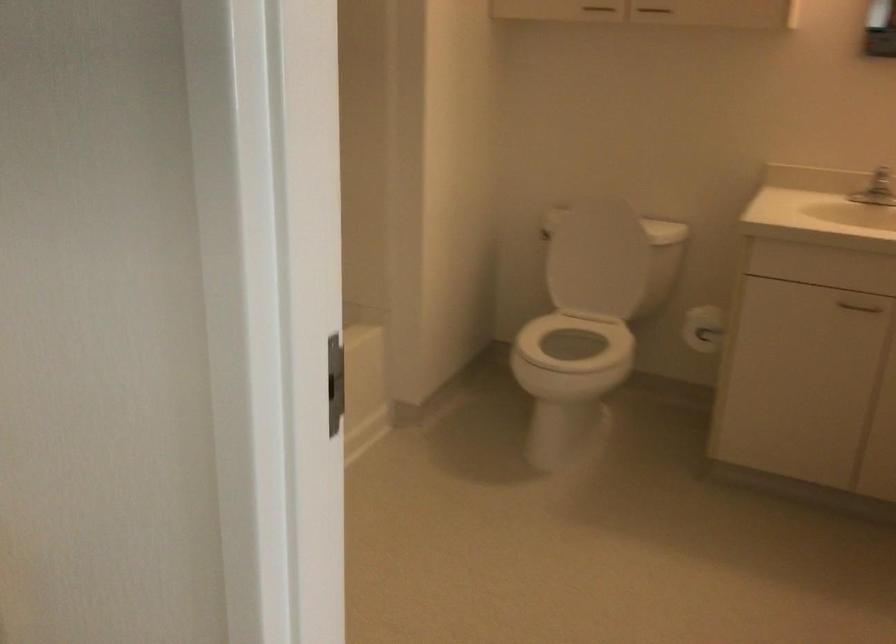
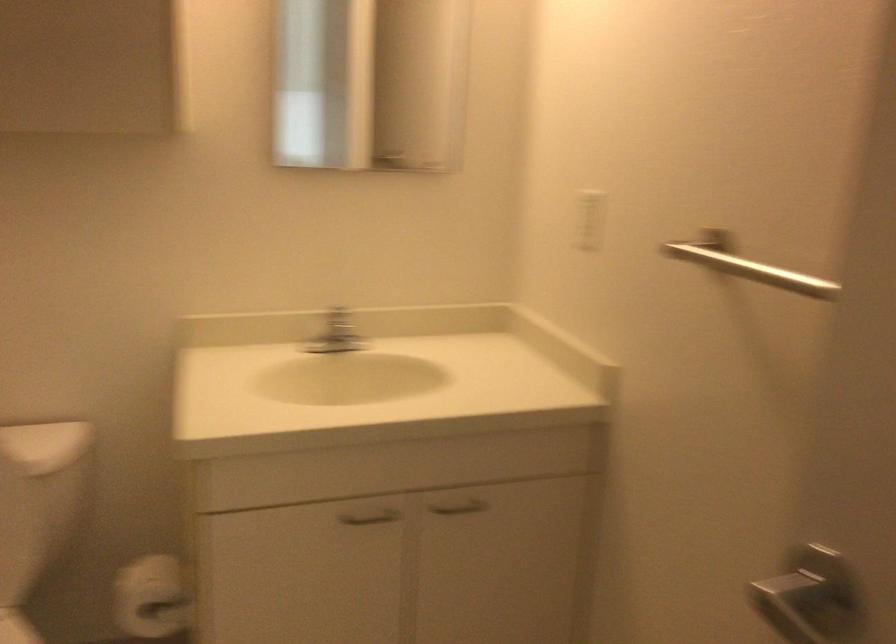
Question: How did the camera likely rotate?

Choices:
 (A) Left
 (B) Right
 (C) Up
 (D) Down

Answer: (B)